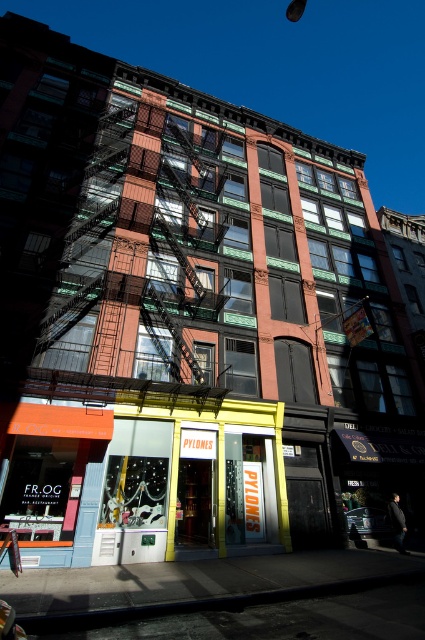
You are standing on the sidewalk in front of the building and want to take a photo of both the rustic metal fire escape at center and the orange matte signboard at lower left. Which object should you focus on first to ensure both are in the frame?

You should focus on the rustic metal fire escape at center first because it is closer to you than the orange matte signboard at lower left, ensuring both are in the frame when properly positioned.

You are standing in front of the multi story building with the FR.OG and PYLONES signs. You need to locate the rustic metal fire escape at center. According to the coordinates provided, where exactly is it positioned?

The rustic metal fire escape at center is located at point (147, 257), which means it is positioned slightly to the right and above the center of the building.